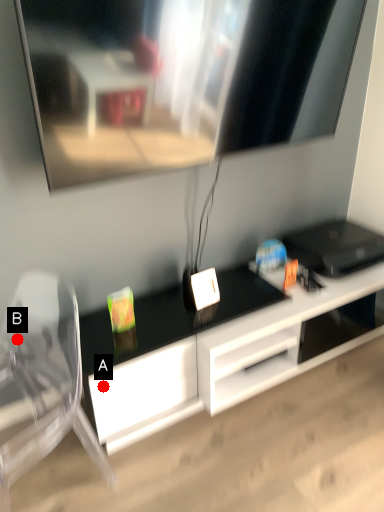
Question: Two points are circled on the image, labeled by A and B beside each circle. Which point is closer to the camera taking this photo?

Choices:
 (A) A is closer
 (B) B is closer

Answer: (A)